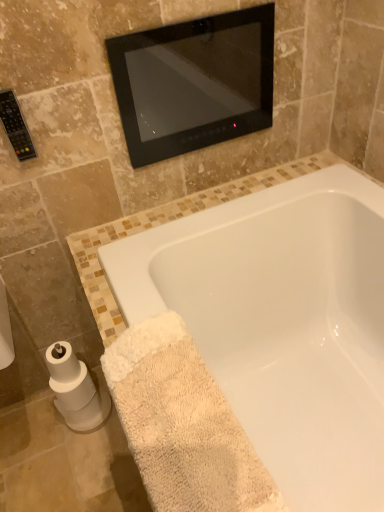
Describe the element at coordinates (182, 424) in the screenshot. I see `beige terry cloth bath towel at lower right` at that location.

Locate an element on the screen. The image size is (384, 512). black glass mirror at upper center is located at coordinates (194, 82).

Is the depth of black glass mirror at upper center greater than that of white glossy bathtub at lower center?

Yes, it is.

Is black glass mirror at upper center aimed at white glossy bathtub at lower center?

No.

From the image's perspective, would you say black glass mirror at upper center is positioned over white glossy bathtub at lower center?

Yes, from the image's perspective, black glass mirror at upper center is over white glossy bathtub at lower center.

From a real-world perspective, who is located lower, black glass mirror at upper center or white glossy bathtub at lower center?

white glossy bathtub at lower center is physically lower.

Locate an element on the screen. toilet paper on the left of black glass mirror at upper center is located at coordinates (75, 389).

Looking at this image, from the image's perspective, is black glass mirror at upper center above or below white matte toilet paper at lower left?

Clearly, from the image's perspective, black glass mirror at upper center is above white matte toilet paper at lower left.

From a real-world perspective, which is physically below, black glass mirror at upper center or white matte toilet paper at lower left?

white matte toilet paper at lower left.

From a real-world perspective, is white glossy bathtub at lower center above or below white matte toilet paper at lower left?

From a real-world perspective, white glossy bathtub at lower center is physically above white matte toilet paper at lower left.

From the image's perspective, is white glossy bathtub at lower center on top of white matte toilet paper at lower left?

Yes, from the image's perspective, white glossy bathtub at lower center is on top of white matte toilet paper at lower left.

Considering their positions, is white glossy bathtub at lower center located in front of or behind white matte toilet paper at lower left?

Visually, white glossy bathtub at lower center is located in front of white matte toilet paper at lower left.

Locate an element on the screen. bathtub in front of the white matte toilet paper at lower left is located at coordinates (282, 324).

Measure the distance between white glossy bathtub at lower center and black glass mirror at upper center.

17.92 inches.

Would you say white glossy bathtub at lower center is to the left or to the right of black glass mirror at upper center in the picture?

Clearly, white glossy bathtub at lower center is on the right of black glass mirror at upper center in the image.

Is white glossy bathtub at lower center taller than black glass mirror at upper center?

Yes, white glossy bathtub at lower center is taller than black glass mirror at upper center.

From a real-world perspective, is white glossy bathtub at lower center above or below black glass mirror at upper center?

In terms of real-world spatial position, white glossy bathtub at lower center is below black glass mirror at upper center.

Is white matte toilet paper at lower left outside of beige terry cloth bath towel at lower right?

Yes, white matte toilet paper at lower left is outside of beige terry cloth bath towel at lower right.

Can you tell me how much white matte toilet paper at lower left and beige terry cloth bath towel at lower right differ in facing direction?

The angle between the facing direction of white matte toilet paper at lower left and the facing direction of beige terry cloth bath towel at lower right is 92.1 degrees.

Which of these two, white matte toilet paper at lower left or beige terry cloth bath towel at lower right, is thinner?

white matte toilet paper at lower left.

Considering the sizes of white matte toilet paper at lower left and beige terry cloth bath towel at lower right in the image, is white matte toilet paper at lower left bigger or smaller than beige terry cloth bath towel at lower right?

In the image, white matte toilet paper at lower left appears to be smaller than beige terry cloth bath towel at lower right.

Find the location of `bath towel on the left of white glossy bathtub at lower center`. bath towel on the left of white glossy bathtub at lower center is located at coordinates (182, 424).

Based on the photo, between white glossy bathtub at lower center and beige terry cloth bath towel at lower right, which one is positioned in front?

beige terry cloth bath towel at lower right is in front.

Could you tell me if white glossy bathtub at lower center is turned towards beige terry cloth bath towel at lower right?

Yes, white glossy bathtub at lower center faces towards beige terry cloth bath towel at lower right.

Can we say beige terry cloth bath towel at lower right lies outside white glossy bathtub at lower center?

Actually, beige terry cloth bath towel at lower right is within white glossy bathtub at lower center.

Where is `bathtub that appears below the beige terry cloth bath towel at lower right (from a real-world perspective)`? This screenshot has width=384, height=512. bathtub that appears below the beige terry cloth bath towel at lower right (from a real-world perspective) is located at coordinates (282, 324).

Which is behind, beige terry cloth bath towel at lower right or white glossy bathtub at lower center?

white glossy bathtub at lower center is further away from the camera.

Who is shorter, beige terry cloth bath towel at lower right or white glossy bathtub at lower center?

With less height is beige terry cloth bath towel at lower right.

Locate an element on the screen. The image size is (384, 512). mirror above the white glossy bathtub at lower center (from the image's perspective) is located at coordinates (194, 82).

In the image, there is a black glass mirror at upper center. Identify the location of toilet paper below it (from the image's perspective). (75, 389).

Considering their positions, is white matte toilet paper at lower left positioned further to beige terry cloth bath towel at lower right than black glass mirror at upper center?

Based on the image, black glass mirror at upper center appears to be further to beige terry cloth bath towel at lower right.

Based on their spatial positions, is beige terry cloth bath towel at lower right or black glass mirror at upper center closer to white glossy bathtub at lower center?

Based on the image, beige terry cloth bath towel at lower right appears to be nearer to white glossy bathtub at lower center.

Estimate the real-world distances between objects in this image. Which object is closer to black glass mirror at upper center, white matte toilet paper at lower left or white glossy bathtub at lower center?

Based on the image, white glossy bathtub at lower center appears to be nearer to black glass mirror at upper center.

Which object lies further to the anchor point beige terry cloth bath towel at lower right, white matte toilet paper at lower left or white glossy bathtub at lower center?

white matte toilet paper at lower left lies further to beige terry cloth bath towel at lower right than the other object.

From the image, which object appears to be nearer to white matte toilet paper at lower left, black glass mirror at upper center or white glossy bathtub at lower center?

Based on the image, white glossy bathtub at lower center appears to be nearer to white matte toilet paper at lower left.

Estimate the real-world distances between objects in this image. Which object is closer to black glass mirror at upper center, white matte toilet paper at lower left or beige terry cloth bath towel at lower right?

beige terry cloth bath towel at lower right is closer to black glass mirror at upper center.

Consider the image. Which object lies nearer to the anchor point white matte toilet paper at lower left, white glossy bathtub at lower center or black glass mirror at upper center?

The object closer to white matte toilet paper at lower left is white glossy bathtub at lower center.

Considering their positions, is black glass mirror at upper center positioned closer to beige terry cloth bath towel at lower right than white glossy bathtub at lower center?

Among the two, white glossy bathtub at lower center is located nearer to beige terry cloth bath towel at lower right.

Locate an element on the screen. Image resolution: width=384 pixels, height=512 pixels. bathtub between beige terry cloth bath towel at lower right and white matte toilet paper at lower left along the z-axis is located at coordinates (282, 324).

Find the location of a particular element. The image size is (384, 512). bathtub between black glass mirror at upper center and beige terry cloth bath towel at lower right in the up-down direction is located at coordinates (282, 324).

Find the location of a particular element. bathtub between black glass mirror at upper center and white matte toilet paper at lower left from top to bottom is located at coordinates [x=282, y=324].

This screenshot has height=512, width=384. What are the coordinates of `bath towel between black glass mirror at upper center and white matte toilet paper at lower left in the up-down direction` in the screenshot? It's located at (182, 424).